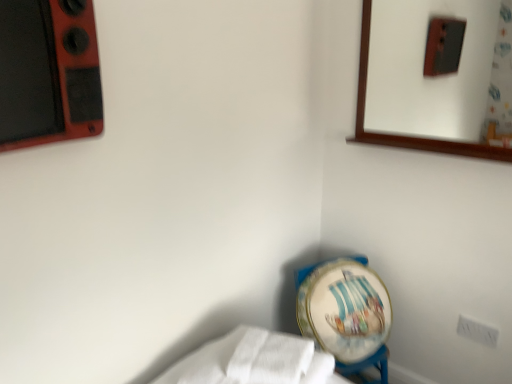
Question: Can you confirm if white fabric at lower left is taller than white plastic electric outlet at lower right?

Choices:
 (A) no
 (B) yes

Answer: (A)

Question: Would you say white fabric at lower left is outside white plastic electric outlet at lower right?

Choices:
 (A) no
 (B) yes

Answer: (B)

Question: Is white fabric at lower left positioned in front of white plastic electric outlet at lower right?

Choices:
 (A) yes
 (B) no

Answer: (A)

Question: Is white fabric at lower left looking in the opposite direction of white plastic electric outlet at lower right?

Choices:
 (A) no
 (B) yes

Answer: (A)

Question: Is white fabric at lower left positioned behind white plastic electric outlet at lower right?

Choices:
 (A) yes
 (B) no

Answer: (B)

Question: Does white fabric at lower left contain white plastic electric outlet at lower right?

Choices:
 (A) no
 (B) yes

Answer: (A)

Question: Can you confirm if wooden-framed mirror at upper right is shorter than white plastic electric outlet at lower right?

Choices:
 (A) no
 (B) yes

Answer: (A)

Question: Considering the relative sizes of wooden-framed mirror at upper right and white plastic electric outlet at lower right in the image provided, is wooden-framed mirror at upper right smaller than white plastic electric outlet at lower right?

Choices:
 (A) no
 (B) yes

Answer: (A)

Question: Considering the relative sizes of wooden-framed mirror at upper right and white plastic electric outlet at lower right in the image provided, is wooden-framed mirror at upper right taller than white plastic electric outlet at lower right?

Choices:
 (A) yes
 (B) no

Answer: (A)

Question: From a real-world perspective, is wooden-framed mirror at upper right below white plastic electric outlet at lower right?

Choices:
 (A) no
 (B) yes

Answer: (A)

Question: Is wooden-framed mirror at upper right located outside white plastic electric outlet at lower right?

Choices:
 (A) yes
 (B) no

Answer: (A)

Question: Could white plastic electric outlet at lower right be considered to be inside wooden-framed mirror at upper right?

Choices:
 (A) no
 (B) yes

Answer: (A)

Question: From a real-world perspective, is white plastic electric outlet at lower right on top of white fabric at lower left?

Choices:
 (A) no
 (B) yes

Answer: (A)